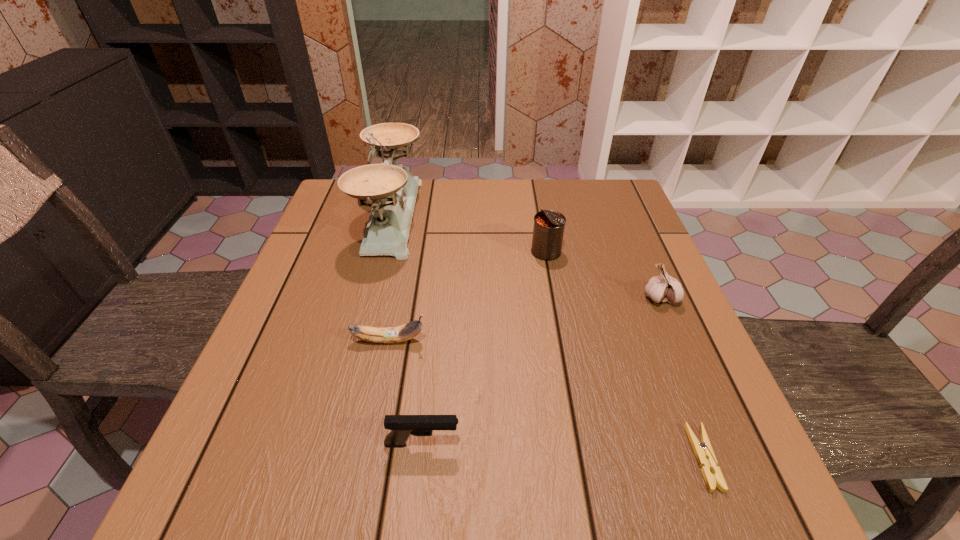
Find the location of a particular element. Image resolution: width=960 pixels, height=540 pixels. free region that satisfies the following two spatial constraints: 1. at the stem of the banana; 2. on the right side of the shortest object is located at coordinates (366, 458).

The image size is (960, 540). I want to click on vacant space that satisfies the following two spatial constraints: 1. on the front-facing side of the garlic; 2. on the right side of the scale, so click(371, 298).

What are the coordinates of `vacant area that satisfies the following two spatial constraints: 1. on the front-facing side of the tallest object; 2. on the left side of the clothespin` in the screenshot? It's located at point(328,458).

Where is `free location that satisfies the following two spatial constraints: 1. on the front-facing side of the clothespin; 2. on the right side of the tallest object`? The height and width of the screenshot is (540, 960). free location that satisfies the following two spatial constraints: 1. on the front-facing side of the clothespin; 2. on the right side of the tallest object is located at coordinates (328, 458).

Identify the location of vacant point that satisfies the following two spatial constraints: 1. on the front-facing side of the second tallest object; 2. on the right side of the scale. (383, 251).

I want to click on free location that satisfies the following two spatial constraints: 1. on the front side of the can; 2. on the right side of the clothespin, so click(583, 458).

Identify the location of vacant point that satisfies the following two spatial constraints: 1. on the front-facing side of the scale; 2. on the back side of the third farthest object. (371, 298).